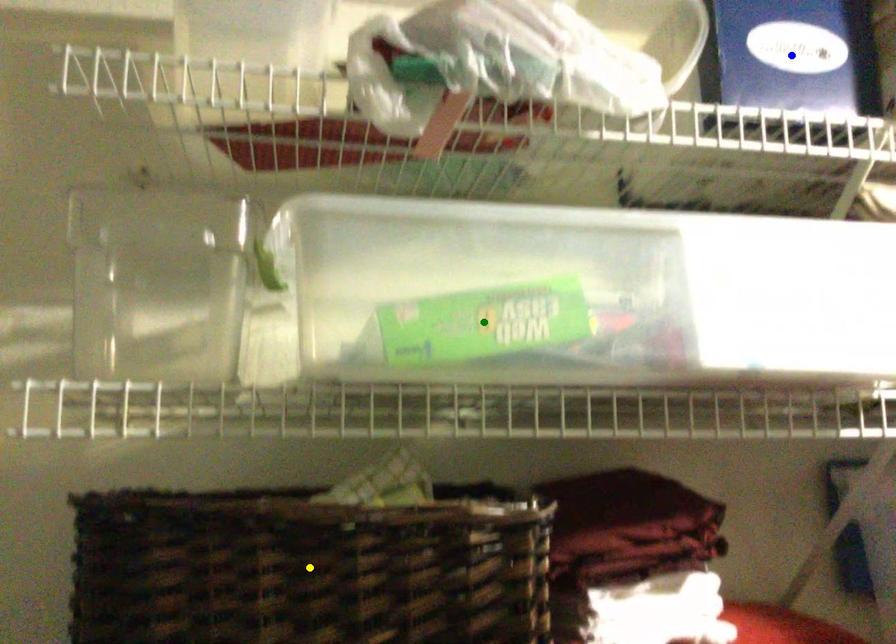
Order these from nearest to farthest:
blue point | yellow point | green point

blue point
green point
yellow point